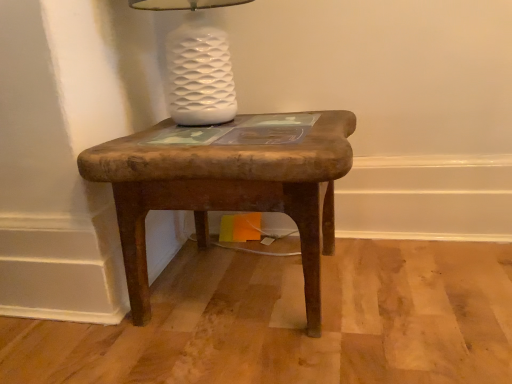
Question: Is white glossy lamp at upper center thinner than rustic wood stool at center?

Choices:
 (A) yes
 (B) no

Answer: (A)

Question: Are white glossy lamp at upper center and rustic wood stool at center beside each other?

Choices:
 (A) no
 (B) yes

Answer: (A)

Question: Does white glossy lamp at upper center have a greater height compared to rustic wood stool at center?

Choices:
 (A) yes
 (B) no

Answer: (B)

Question: Is white glossy lamp at upper center at the right side of rustic wood stool at center?

Choices:
 (A) yes
 (B) no

Answer: (B)

Question: Can you confirm if white glossy lamp at upper center is bigger than rustic wood stool at center?

Choices:
 (A) yes
 (B) no

Answer: (B)

Question: Is white glossy lamp at upper center shorter than rustic wood stool at center?

Choices:
 (A) no
 (B) yes

Answer: (B)

Question: From the image's perspective, is rustic wood stool at center under white glossy lamp at upper center?

Choices:
 (A) no
 (B) yes

Answer: (B)

Question: From the image's perspective, is rustic wood stool at center over white glossy lamp at upper center?

Choices:
 (A) yes
 (B) no

Answer: (B)

Question: Does rustic wood stool at center have a smaller size compared to white glossy lamp at upper center?

Choices:
 (A) yes
 (B) no

Answer: (B)

Question: Is rustic wood stool at center taller than white glossy lamp at upper center?

Choices:
 (A) yes
 (B) no

Answer: (A)

Question: From a real-world perspective, does rustic wood stool at center stand above white glossy lamp at upper center?

Choices:
 (A) no
 (B) yes

Answer: (A)

Question: Does rustic wood stool at center have a greater width compared to white glossy lamp at upper center?

Choices:
 (A) yes
 (B) no

Answer: (A)

Question: Which is correct: white glossy lamp at upper center is inside rustic wood stool at center, or outside of it?

Choices:
 (A) outside
 (B) inside

Answer: (A)